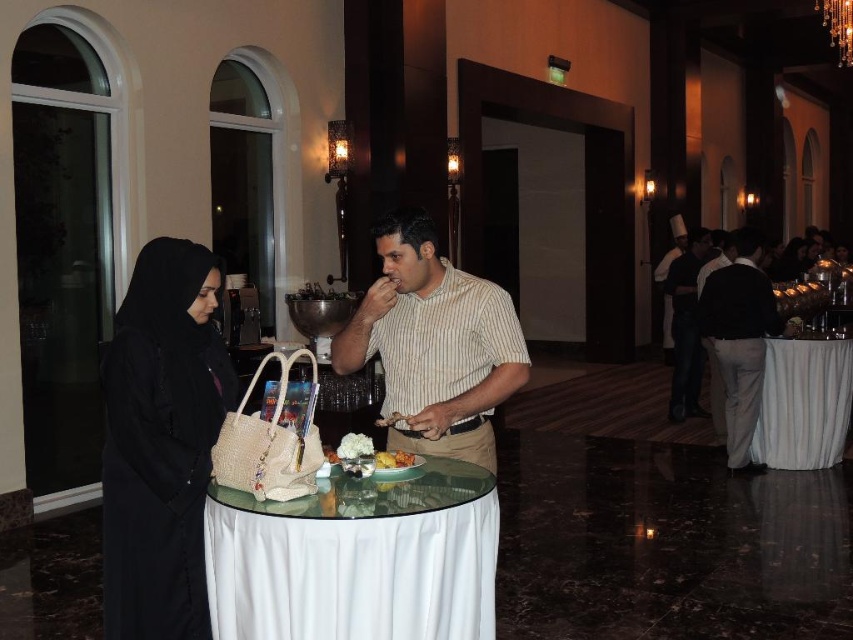
Question: Among these objects, which one is nearest to the camera?

Choices:
 (A) striped cotton shirt at center
 (B) black fabric pants at right
 (C) white glossy plate at center
 (D) dark brown leather jacket at right

Answer: (A)

Question: Which point is closer to the camera?

Choices:
 (A) white cloth-covered table at center
 (B) black fabric dress at center
 (C) black fabric pants at right

Answer: (A)

Question: Is white cloth-covered table at right above black fabric pants at right?

Choices:
 (A) no
 (B) yes

Answer: (A)

Question: Does black woven abaya at left appear on the right side of black fabric dress at center?

Choices:
 (A) yes
 (B) no

Answer: (B)

Question: Does white cloth-covered table at center lie behind dark brown leather jacket at right?

Choices:
 (A) no
 (B) yes

Answer: (A)

Question: Which object is closer to the camera taking this photo?

Choices:
 (A) golden brown bread at center
 (B) white cloth-covered table at right
 (C) dark brown leather jacket at right

Answer: (A)